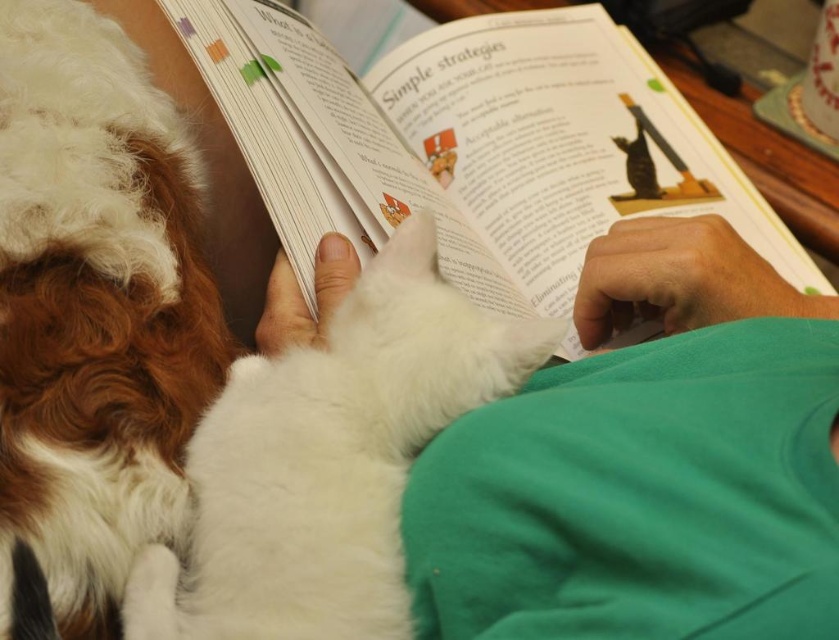
You are a photographer trying to capture a closeup shot of the book the person is reading. You have a camera with a 4 inch wide lens. The book is between the brown and white fur at left and the white fluffy cat at center. Can you fit the book into your camera lens without moving the camera?

The distance between the brown and white fur at left and the white fluffy cat at center is 3.90 inches. Since the lens is 4 inches wide, the book can fit within the camera lens as the distance is slightly less than the lens width.

You are a pet owner trying to determine which cat is more compact in size between the white fluffy cat at center and the white fur cat at center. Based on the scene, which cat should you consider to be smaller?

The white fluffy cat at center is more compact in size compared to the white fur cat at center since its width is less than the other.

You are a delivery robot with a package that needs to be placed between the white paper at center and brown and white fur at left. The package is 10 inches long. Can you fit it between them without moving either object?

The distance between the white paper at center and brown and white fur at left is 9.54 inches. Since the package is 10 inches long, it cannot fit between them without moving either object.